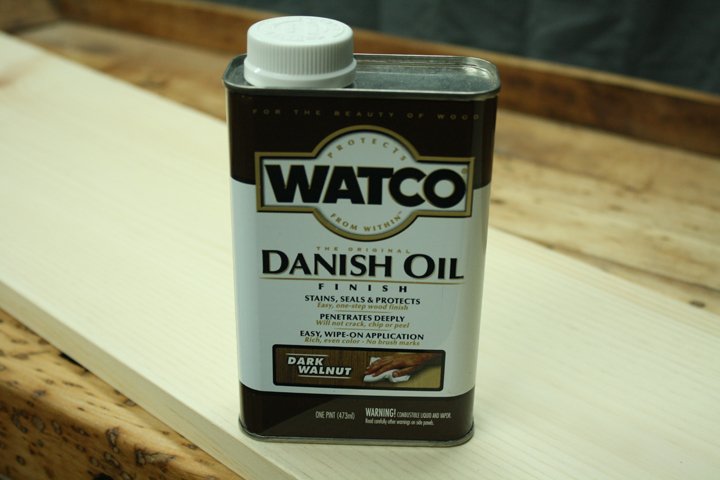
I want to click on brown wooden surface, so click(x=625, y=198).